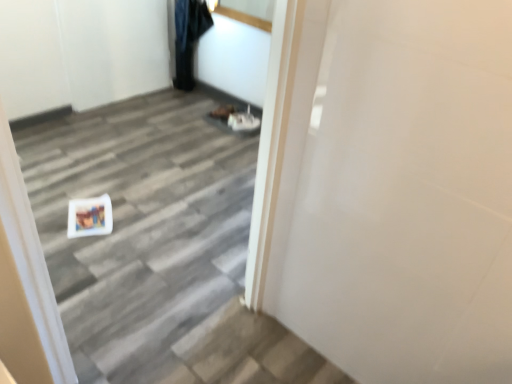
This screenshot has width=512, height=384. Find the location of `free region under white glossy door at center (from a real-world perspective)`. free region under white glossy door at center (from a real-world perspective) is located at coordinates (163, 353).